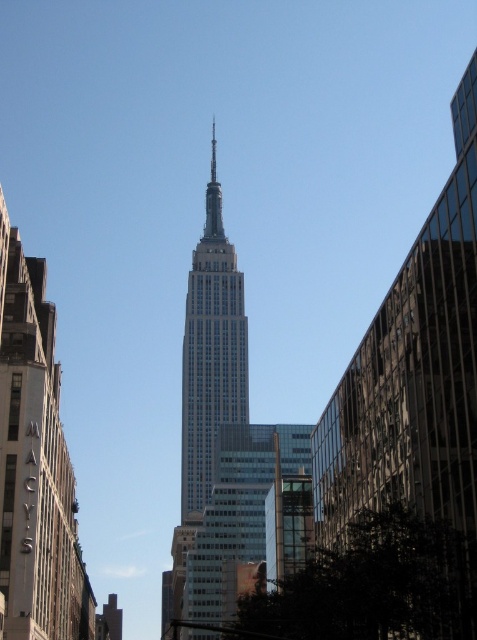
You are standing in New York City and see both the matte glass skyscraper at center and the white glass building at center. Which one is positioned to the left?

The matte glass skyscraper at center is positioned to the left of the white glass building at center.

You are a delivery drone that needs to fly between the glassy reflective skyscraper at center and the white glass building at center. The minimum safe distance for your drone to pass between two buildings is 100 meters. Can you safely navigate through the gap between them?

The distance between the glassy reflective skyscraper at center and the white glass building at center is 110.03 meters, which is greater than the minimum safe distance of 100 meters. Therefore, the drone can safely navigate through the gap between them.

You are standing at the observation deck of the Empire State Building and want to take a photo of both the glassy reflective skyscraper at center and the matte glass skyscraper at center. Since your camera has a limited field of view, can you fit both skyscrapers in the frame if they are 29.05 meters apart?

The glassy reflective skyscraper at center and the matte glass skyscraper at center are 29.05 meters apart. However, since both skyscrapers are at the center, they are likely the same building, so you cannot fit both in the frame as they are the same structure.